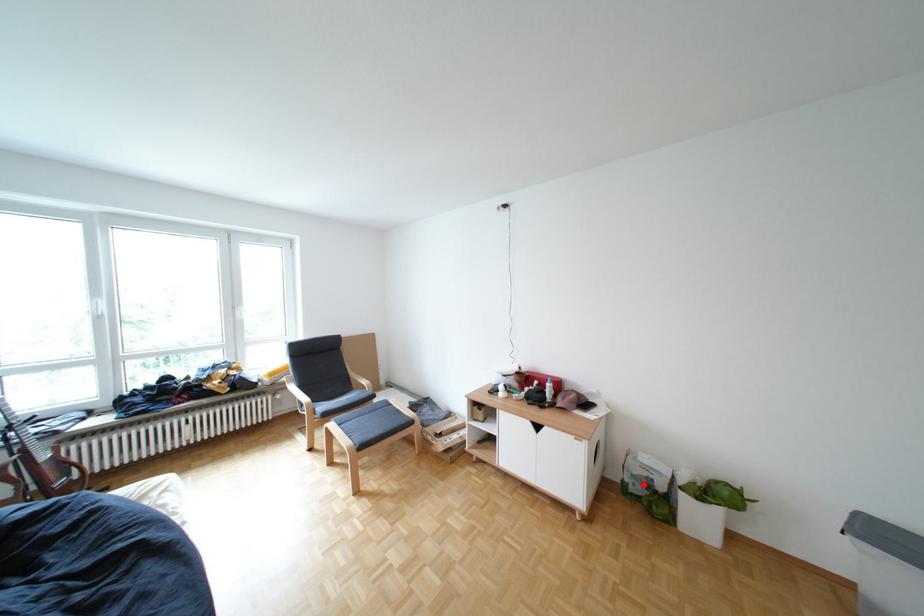
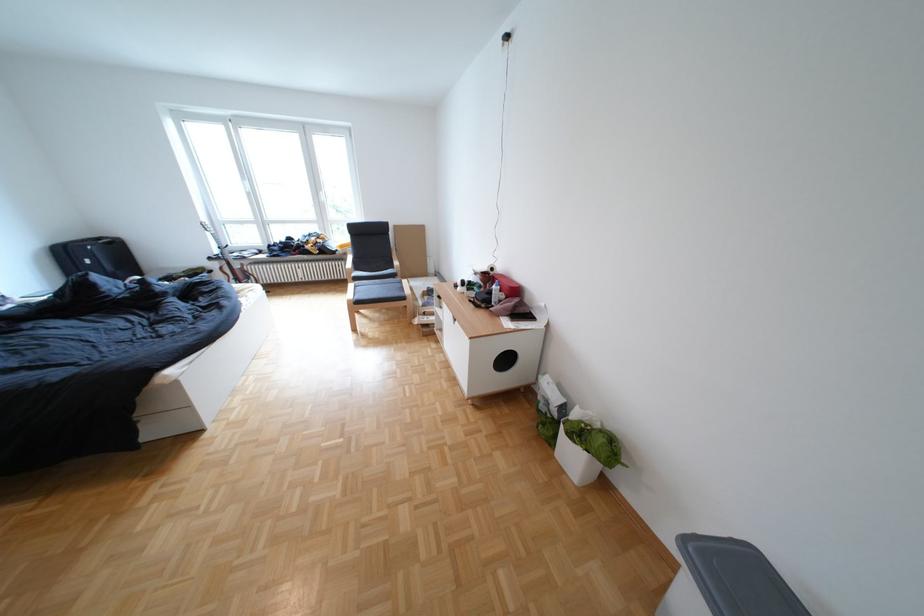
Where in the second image is the point corresponding to the highlighted location from the first image?

(554, 402)